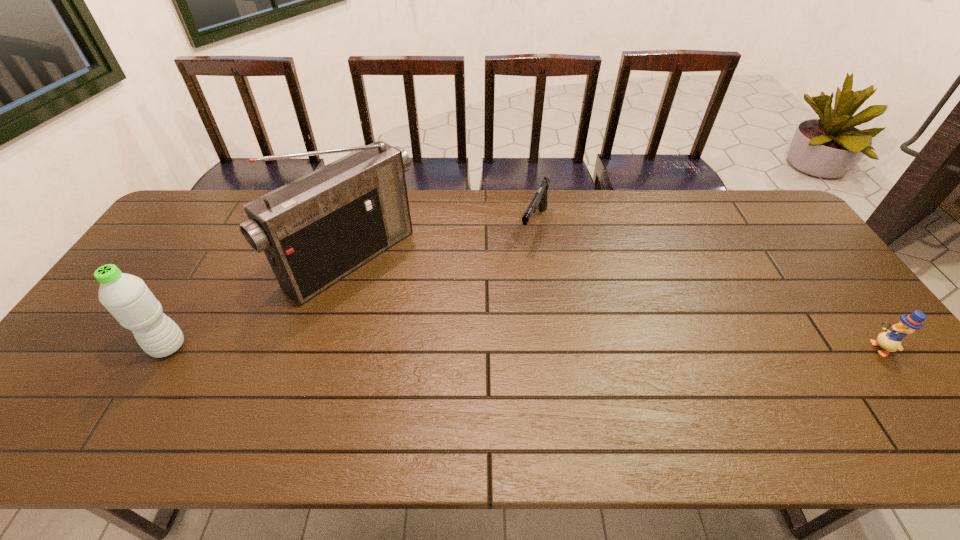
Find the location of `vacant space on the desktop that is between the leftmost object and the rightmost object and is positioned at the aiming end of the gun`. vacant space on the desktop that is between the leftmost object and the rightmost object and is positioned at the aiming end of the gun is located at coordinates (473, 347).

This screenshot has width=960, height=540. I want to click on free space on the desktop that is between the leftmost object and the rightmost object and is positioned on the front-facing side of the tallest object, so click(468, 347).